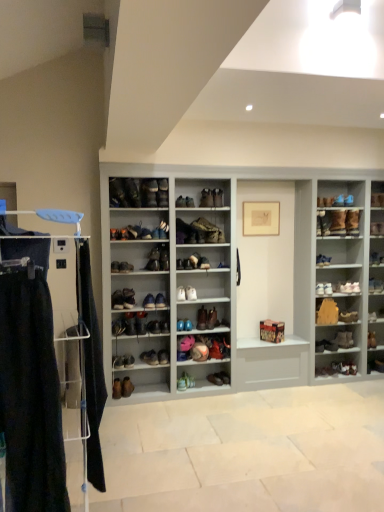
Find the location of a particular element. The width and height of the screenshot is (384, 512). blank space to the left of matte brown shoe at center, which is the sixteenth shoe from right to left is located at coordinates (170, 390).